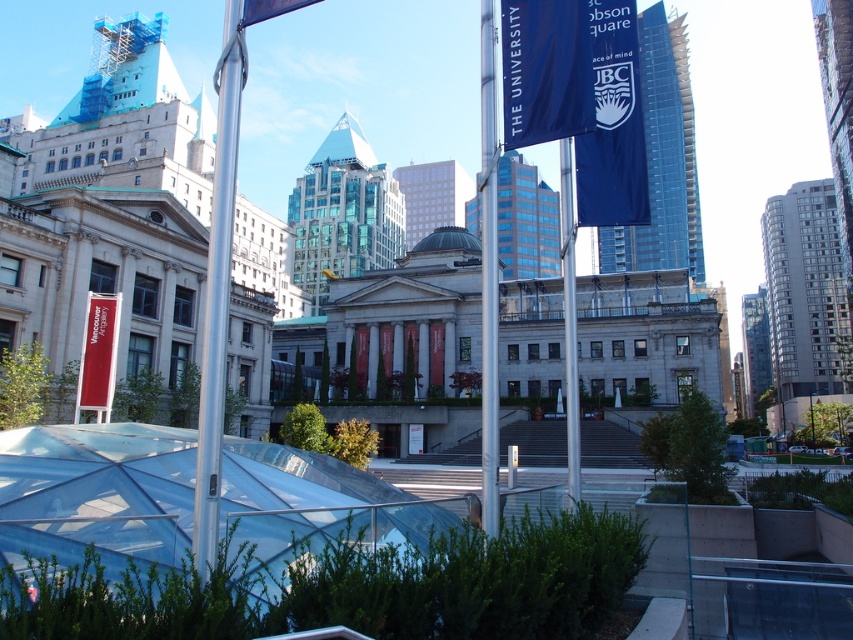
Is point (212, 198) closer to viewer compared to point (523, 29)?

No, (212, 198) is behind (523, 29).

Does polished silver pole at center have a larger size compared to blue fabric flag at upper center?

Yes.

Does point (213, 390) lie in front of point (511, 64)?

That is True.

Find the location of a particular element. polished silver pole at center is located at coordinates (218, 289).

Between blue fabric flag at upper center and metallic silver pole at center, which one has less height?

blue fabric flag at upper center

Between blue fabric flag at upper center and metallic silver pole at center, which one is positioned higher?

blue fabric flag at upper center is higher up.

This screenshot has width=853, height=640. Identify the location of blue fabric flag at upper center. (544, 70).

Find the location of a particular element. blue fabric flag at upper center is located at coordinates (544, 70).

Is polished silver pole at center to the left of blue fabric banner at upper center from the viewer's perspective?

Indeed, polished silver pole at center is positioned on the left side of blue fabric banner at upper center.

Measure the distance between point (225,209) and camera.

Point (225,209) is 21.30 meters from camera.

The width and height of the screenshot is (853, 640). Find the location of `polished silver pole at center`. polished silver pole at center is located at coordinates (218, 289).